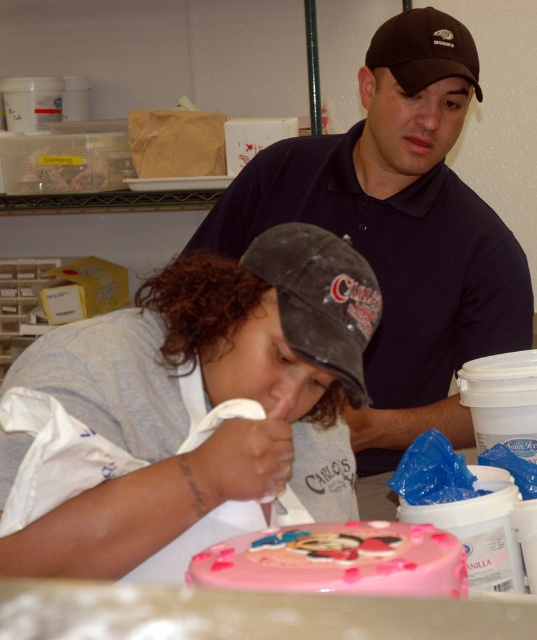
Question: Among these objects, which one is farthest from the camera?

Choices:
 (A) pink glossy cake at center
 (B) black fabric baseball cap at upper center

Answer: (B)

Question: From the image, what is the correct spatial relationship of black matte baseball cap at upper center in relation to black matte baseball cap at center?

Choices:
 (A) right
 (B) left

Answer: (A)

Question: From the image, what is the correct spatial relationship of black matte baseball cap at upper center in relation to black fabric baseball cap at upper center?

Choices:
 (A) left
 (B) right

Answer: (A)

Question: Which is nearer to the black fabric baseball cap at upper center?

Choices:
 (A) gray fabric apron at lower left
 (B) black matte baseball cap at upper center
 (C) black matte baseball cap at center

Answer: (B)

Question: From the image, what is the correct spatial relationship of gray fabric apron at lower left in relation to black fabric baseball cap at upper center?

Choices:
 (A) below
 (B) above

Answer: (A)

Question: Which object is positioned farthest from the gray fabric apron at lower left?

Choices:
 (A) black fabric baseball cap at upper center
 (B) pink glossy cake at center

Answer: (A)